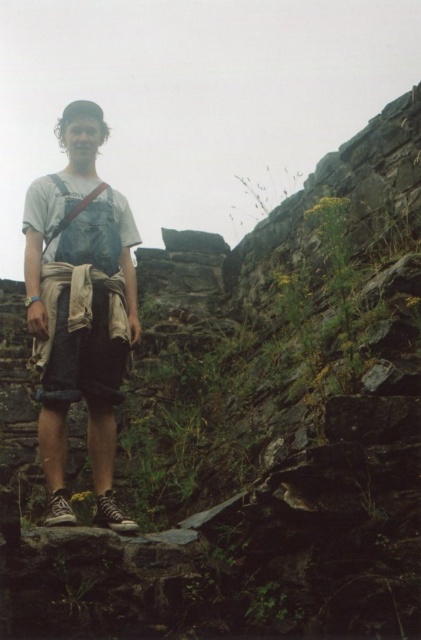
You are a hiker who needs to adjust your gear. You have a denim shorts at center and a denim suspenders at center. How far apart are these two items on your body?

The denim shorts at center are 7.11 meters away from the denim suspenders at center.

You are trying to determine the clothing items on the person in the image. Which item, the denim overalls at center or the denim suspenders at center, has a larger width?

The denim overalls at center is wider than the denim suspenders at center according to the description.